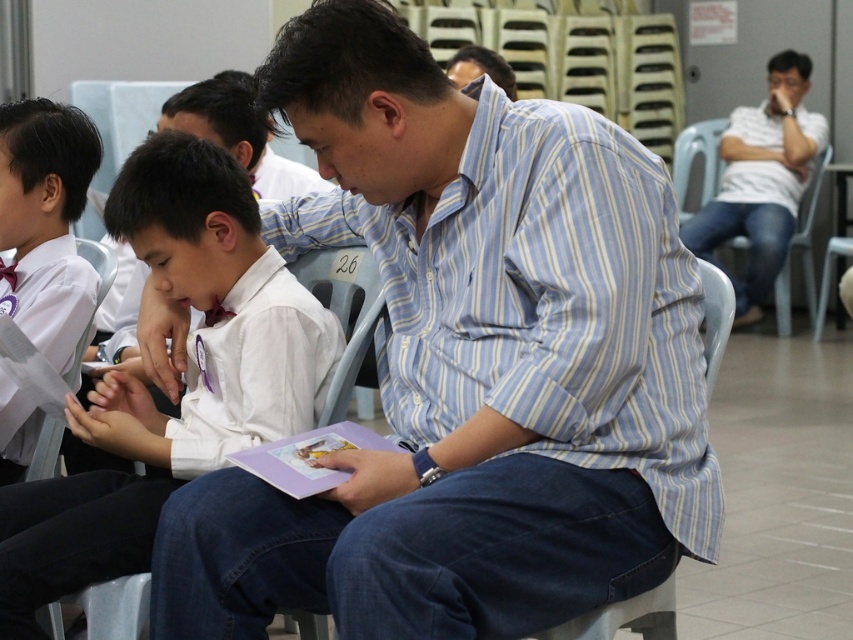
You are a photographer trying to capture a candid shot of the blue striped shirt at center and the white uniform shirt at left. Since you want to frame both subjects in the same photo, can you determine if they are positioned side by side or one in front of the other?

The blue striped shirt at center is positioned on the right side of white uniform shirt at left, so they are positioned side by side.

You are a photographer standing in the waiting area and want to take a photo of both the white uniform shirt at left and the white cotton shirt at upper right. Which shirt should you focus on first to ensure both are in the frame?

The white uniform shirt at left is positioned on the left side of white cotton shirt at upper right, so you should focus on the white uniform shirt at left first to ensure both are in the frame.

You are a photographer standing in the scene. You need to take a photo of both the white shirt at center and the white uniform shirt at left. Can you fit both subjects in the frame without moving either of them?

The white shirt at center and the white uniform shirt at left are 21.47 inches apart from each other. Since the distance between them is less than the typical camera frame width, you can fit both subjects in the frame without moving them.